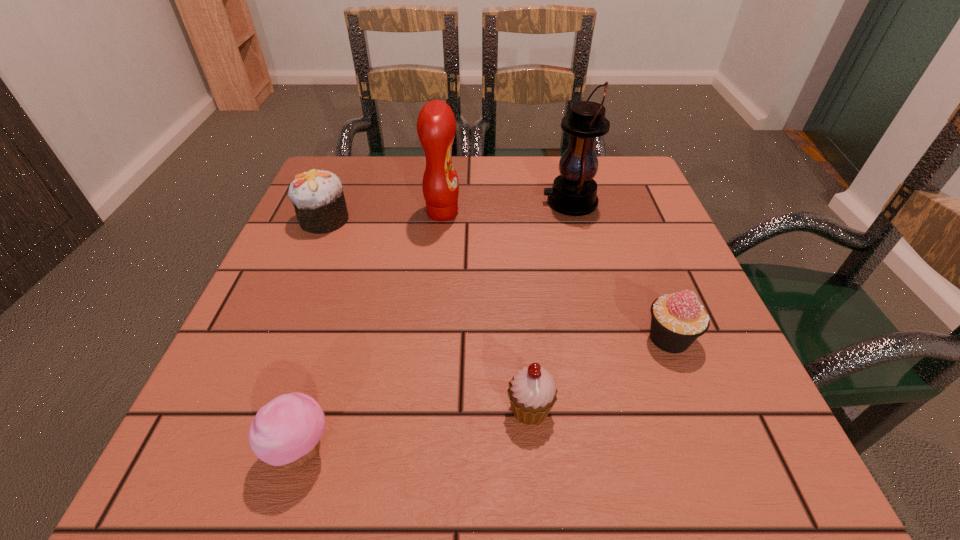
In order to click on free space between the condiment and the third nearest cupcake in this screenshot , I will do `click(556, 275)`.

You are a GUI agent. You are given a task and a screenshot of the screen. Output one action in this format:
    pyautogui.click(x=<x>, y=<y>)
    Task: Click on the free point between the farthest cupcake and the second cupcake from right to left
    This screenshot has height=540, width=960.
    Given the screenshot: What is the action you would take?
    pyautogui.click(x=427, y=314)

At what (x,y) coordinates should I click in order to perform the action: click on vacant space that is in between the rightmost cupcake and the fifth object from left to right. Please return your answer as a coordinate pair (x, y). This screenshot has width=960, height=540. Looking at the image, I should click on (620, 270).

In order to click on empty space between the fourth farthest object and the second object from right to left in this screenshot , I will do click(x=620, y=270).

Locate an element on the screen. free space between the farthest cupcake and the rightmost object is located at coordinates (497, 279).

The width and height of the screenshot is (960, 540). What are the coordinates of `object that stands as the closest to the farthest cupcake` in the screenshot? It's located at (436, 125).

This screenshot has width=960, height=540. In order to click on object identified as the fourth closest to the fourth object from right to left in this screenshot , I will do `click(677, 320)`.

I want to click on cupcake that is the closest to the fourth object from left to right, so click(677, 320).

Identify which cupcake is the fourth closest to the lantern. Please provide its 2D coordinates. Your answer should be formatted as a tuple, i.e. [(x, y)], where the tuple contains the x and y coordinates of a point satisfying the conditions above.

[(286, 431)]

At what (x,y) coordinates should I click in order to perform the action: click on vacant space that satisfies the following two spatial constraints: 1. on the back side of the rightmost object; 2. above the fifth object from left to right, indicating its light source. Please return your answer as a coordinate pair (x, y). This screenshot has width=960, height=540. Looking at the image, I should click on click(x=616, y=202).